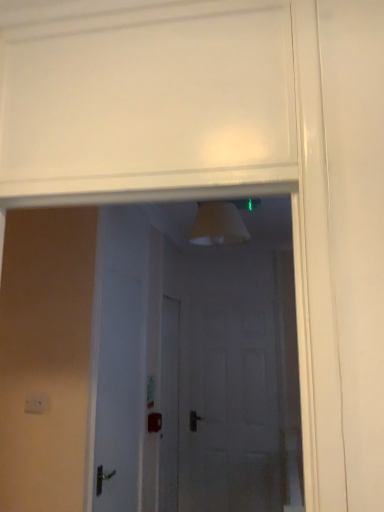
Question: Is white matte door at center oriented away from white matte door at center?

Choices:
 (A) yes
 (B) no

Answer: (B)

Question: Is white matte door at center completely or partially inside white matte door at center?

Choices:
 (A) no
 (B) yes

Answer: (A)

Question: Is white matte door at center touching white matte door at center?

Choices:
 (A) no
 (B) yes

Answer: (A)

Question: From the image's perspective, is white matte door at center located beneath white matte door at center?

Choices:
 (A) yes
 (B) no

Answer: (A)

Question: Are white matte door at center and white matte door at center located far from each other?

Choices:
 (A) yes
 (B) no

Answer: (A)

Question: From a real-world perspective, is white matte door at center on top of white matte door at center?

Choices:
 (A) yes
 (B) no

Answer: (B)

Question: From the image's perspective, is white matte door at center on top of white matte door at center?

Choices:
 (A) no
 (B) yes

Answer: (B)

Question: Is white matte door at center looking in the opposite direction of white matte door at center?

Choices:
 (A) yes
 (B) no

Answer: (B)

Question: Does white matte door at center contain white matte door at center?

Choices:
 (A) yes
 (B) no

Answer: (B)

Question: Is the depth of white matte door at center less than that of white matte door at center?

Choices:
 (A) no
 (B) yes

Answer: (B)

Question: From the image's perspective, is white matte door at center located beneath white matte door at center?

Choices:
 (A) no
 (B) yes

Answer: (A)

Question: Considering the relative sizes of white matte door at center and white matte door at center in the image provided, is white matte door at center wider than white matte door at center?

Choices:
 (A) no
 (B) yes

Answer: (A)

Question: Is white matte door at center in front of or behind white matte door at center in the image?

Choices:
 (A) behind
 (B) front

Answer: (A)